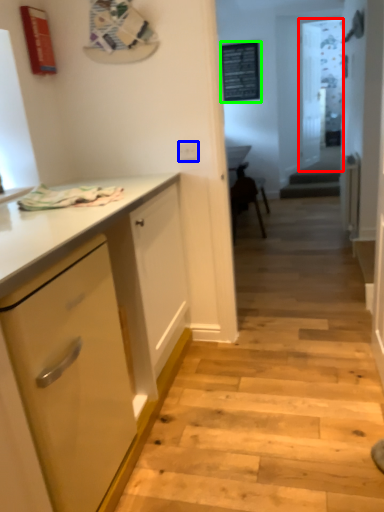
Question: Which object is the farthest from glass door (highlighted by a red box)? Choose among these: electric outlet (highlighted by a blue box) or bulletin board (highlighted by a green box).

Choices:
 (A) electric outlet
 (B) bulletin board

Answer: (A)